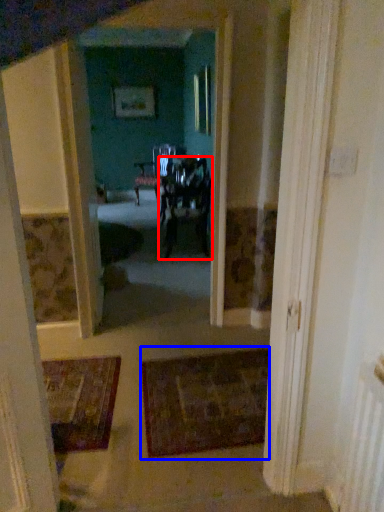
Question: Among these objects, which one is nearest to the camera, chair (highlighted by a red box) or doormat (highlighted by a blue box)?

Choices:
 (A) chair
 (B) doormat

Answer: (B)